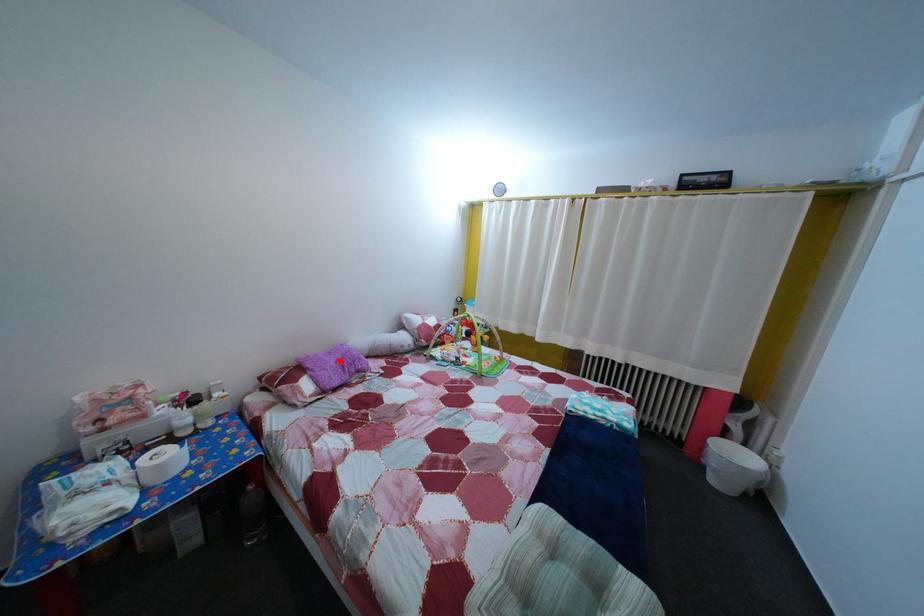
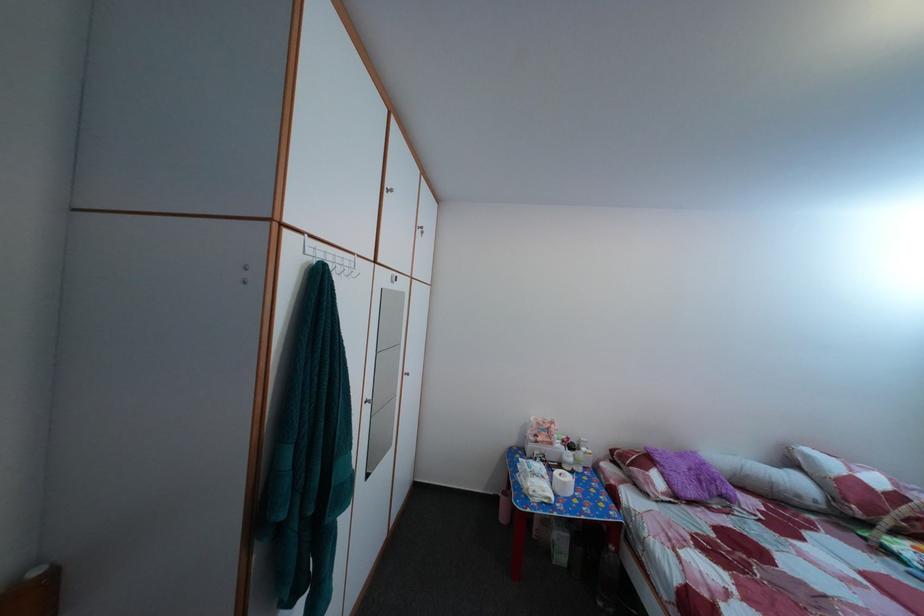
Question: I am providing you with two images of the same scene from different viewpoints. In image1, a red point is highlighted. Considering the same 3D point in image2, which of the following is correct?

Choices:
 (A) It is closer
 (B) It is farther

Answer: (B)